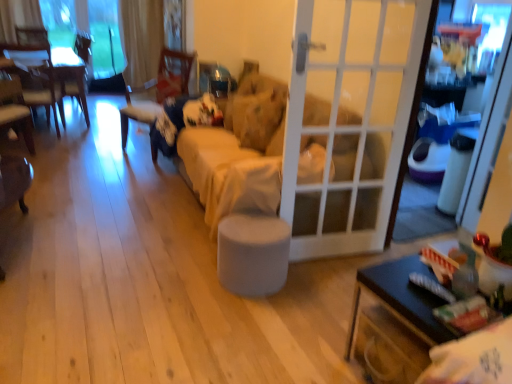
The height and width of the screenshot is (384, 512). Find the location of `vacant area that is in front of gray fabric stool at center`. vacant area that is in front of gray fabric stool at center is located at coordinates (234, 308).